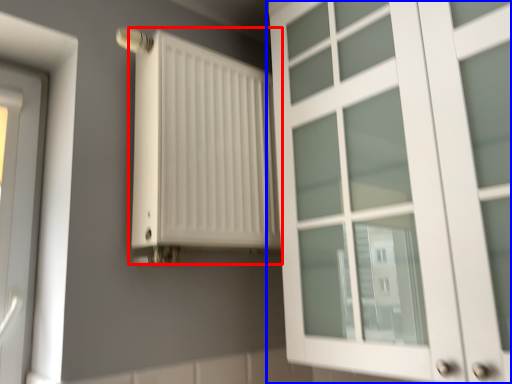
Question: Which object is further to the camera taking this photo, radiator (highlighted by a red box) or cupboard (highlighted by a blue box)?

Choices:
 (A) radiator
 (B) cupboard

Answer: (A)